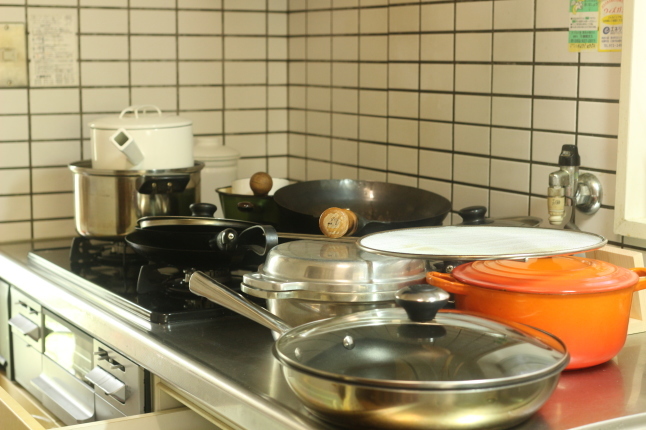
This screenshot has height=430, width=646. I want to click on drawer, so click(157, 418).